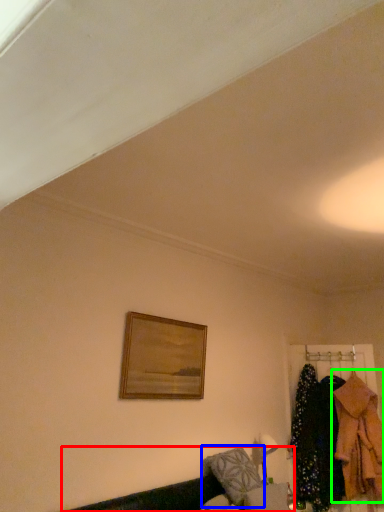
Question: Estimate the real-world distances between objects in this image. Which object is farther from couch (highlighted by a red box), pillow (highlighted by a blue box) or clothing (highlighted by a green box)?

Choices:
 (A) pillow
 (B) clothing

Answer: (B)